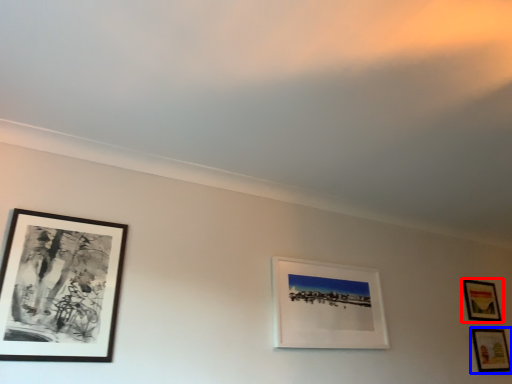
Question: Which point is closer to the camera, picture frame (highlighted by a red box) or picture frame (highlighted by a blue box)?

Choices:
 (A) picture frame
 (B) picture frame

Answer: (B)